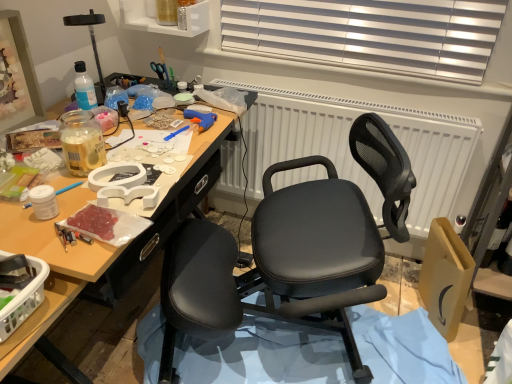
What do you see at coordinates (305, 256) in the screenshot? The image size is (512, 384). I see `black leather chair at center` at bounding box center [305, 256].

The width and height of the screenshot is (512, 384). Identify the location of clear plastic bottle at upper center. (182, 14).

Measure the distance between white textured radiator at center and camera.

The distance of white textured radiator at center from camera is 4.28 feet.

Locate an element on the screen. The width and height of the screenshot is (512, 384). white textured radiator at center is located at coordinates (350, 153).

You are a GUI agent. You are given a task and a screenshot of the screen. Output one action in this format:
    pyautogui.click(x=<x>, y=<y>)
    Task: Click on the translucent plastic basket at lower left
    The height and width of the screenshot is (384, 512).
    Given the screenshot: What is the action you would take?
    pyautogui.click(x=24, y=299)

Considering the positions of objects white textured radiator at center and clear plastic bottle at upper center in the image provided, who is more to the right, white textured radiator at center or clear plastic bottle at upper center?

white textured radiator at center is more to the right.

Is white textured radiator at center touching clear plastic bottle at upper center?

white textured radiator at center is not next to clear plastic bottle at upper center, and they're not touching.

Can you confirm if white textured radiator at center is bigger than clear plastic bottle at upper center?

Yes.

What's the angular difference between white textured radiator at center and clear plastic bottle at upper center's facing directions?

The angle between the facing direction of white textured radiator at center and the facing direction of clear plastic bottle at upper center is 2.31 degrees.

Who is bigger, black leather chair at center or translucent plastic basket at lower left?

Bigger between the two is black leather chair at center.

In the scene shown: In terms of height, does black leather chair at center look taller or shorter compared to translucent plastic basket at lower left?

black leather chair at center is taller than translucent plastic basket at lower left.

Find the location of `box in front of the black leather chair at center`. box in front of the black leather chair at center is located at coordinates (x=24, y=299).

Is black leather chair at center in contact with translucent plastic basket at lower left?

There is a gap between black leather chair at center and translucent plastic basket at lower left.

Is white textured radiator at center wider or thinner than translucent plastic basket at lower left?

Clearly, white textured radiator at center has less width compared to translucent plastic basket at lower left.

Measure the distance between white textured radiator at center and translucent plastic basket at lower left.

white textured radiator at center and translucent plastic basket at lower left are 3.77 feet apart from each other.

From a real-world perspective, who is located lower, white textured radiator at center or translucent plastic basket at lower left?

white textured radiator at center, from a real-world perspective.

Is there a large distance between white textured radiator at center and translucent plastic basket at lower left?

Yes, white textured radiator at center is far from translucent plastic basket at lower left.

How many degrees apart are the facing directions of white textured radiator at center and black leather chair at center?

The facing directions of white textured radiator at center and black leather chair at center are 23.3 degrees apart.

Could you tell me if white textured radiator at center is turned towards black leather chair at center?

Yes.

Is white textured radiator at center shorter than black leather chair at center?

Correct, white textured radiator at center is not as tall as black leather chair at center.

Considering the positions of points (434, 165) and (348, 281), is point (434, 165) farther from camera compared to point (348, 281)?

That is True.

Which is less distant, (185, 14) or (4, 308)?

Point (185, 14) appears to be farther away from the viewer than point (4, 308).

Is the depth of clear plastic bottle at upper center greater than that of translucent plastic basket at lower left?

Yes, it is behind translucent plastic basket at lower left.

In terms of width, does clear plastic bottle at upper center look wider or thinner when compared to translucent plastic basket at lower left?

Considering their sizes, clear plastic bottle at upper center looks slimmer than translucent plastic basket at lower left.

Would you say clear plastic bottle at upper center is to the left or to the right of white textured radiator at center in the picture?

From the image, it's evident that clear plastic bottle at upper center is to the left of white textured radiator at center.

From the image's perspective, between clear plastic bottle at upper center and white textured radiator at center, who is located below?

white textured radiator at center.

From their relative heights in the image, would you say clear plastic bottle at upper center is taller or shorter than white textured radiator at center?

Clearly, clear plastic bottle at upper center is shorter compared to white textured radiator at center.

Is clear plastic bottle at upper center oriented away from white textured radiator at center?

That's not correct — clear plastic bottle at upper center is not looking away from white textured radiator at center.

Would you say translucent plastic basket at lower left is a long distance from white textured radiator at center?

translucent plastic basket at lower left is far away from white textured radiator at center.

Between translucent plastic basket at lower left and white textured radiator at center, which one appears on the right side from the viewer's perspective?

From the viewer's perspective, white textured radiator at center appears more on the right side.

Which is in front, point (24, 302) or point (279, 102)?

The point (24, 302) is more forward.

Considering the sizes of objects translucent plastic basket at lower left and white textured radiator at center in the image provided, who is taller, translucent plastic basket at lower left or white textured radiator at center?

Standing taller between the two is white textured radiator at center.

Where is `bottle on the left of the white textured radiator at center`? This screenshot has height=384, width=512. bottle on the left of the white textured radiator at center is located at coordinates (182, 14).

What are the coordinates of `chair below the translucent plastic basket at lower left (from a real-world perspective)` in the screenshot? It's located at (305, 256).

Based on their spatial positions, is clear plastic bottle at upper center or white textured radiator at center further from black leather chair at center?

Among the two, clear plastic bottle at upper center is located further to black leather chair at center.

Based on their spatial positions, is clear plastic bottle at upper center or white textured radiator at center further from translucent plastic basket at lower left?

clear plastic bottle at upper center lies further to translucent plastic basket at lower left than the other object.

When comparing their distances from black leather chair at center, does clear plastic bottle at upper center or translucent plastic basket at lower left seem further?

The object further to black leather chair at center is clear plastic bottle at upper center.

From the image, which object appears to be farther from translucent plastic basket at lower left, clear plastic bottle at upper center or black leather chair at center?

clear plastic bottle at upper center lies further to translucent plastic basket at lower left than the other object.

Estimate the real-world distances between objects in this image. Which object is closer to clear plastic bottle at upper center, white textured radiator at center or black leather chair at center?

Based on the image, white textured radiator at center appears to be nearer to clear plastic bottle at upper center.

Estimate the real-world distances between objects in this image. Which object is further from white textured radiator at center, black leather chair at center or translucent plastic basket at lower left?

The object further to white textured radiator at center is translucent plastic basket at lower left.

Based on their spatial positions, is clear plastic bottle at upper center or translucent plastic basket at lower left further from white textured radiator at center?

Among the two, translucent plastic basket at lower left is located further to white textured radiator at center.

From the picture: When comparing their distances from clear plastic bottle at upper center, does black leather chair at center or white textured radiator at center seem closer?

white textured radiator at center lies closer to clear plastic bottle at upper center than the other object.

The image size is (512, 384). What are the coordinates of `chair positioned between translucent plastic basket at lower left and white textured radiator at center from near to far` in the screenshot? It's located at point(305,256).

You are a GUI agent. You are given a task and a screenshot of the screen. Output one action in this format:
    pyautogui.click(x=<x>, y=<y>)
    Task: Click on the radiator between translucent plastic basket at lower left and clear plastic bottle at upper center in the front-back direction
    Image resolution: width=512 pixels, height=384 pixels.
    Given the screenshot: What is the action you would take?
    pyautogui.click(x=350, y=153)

Identify the location of chair between translucent plastic basket at lower left and clear plastic bottle at upper center from front to back. coord(305,256).

This screenshot has width=512, height=384. I want to click on radiator between clear plastic bottle at upper center and black leather chair at center in the vertical direction, so click(350, 153).